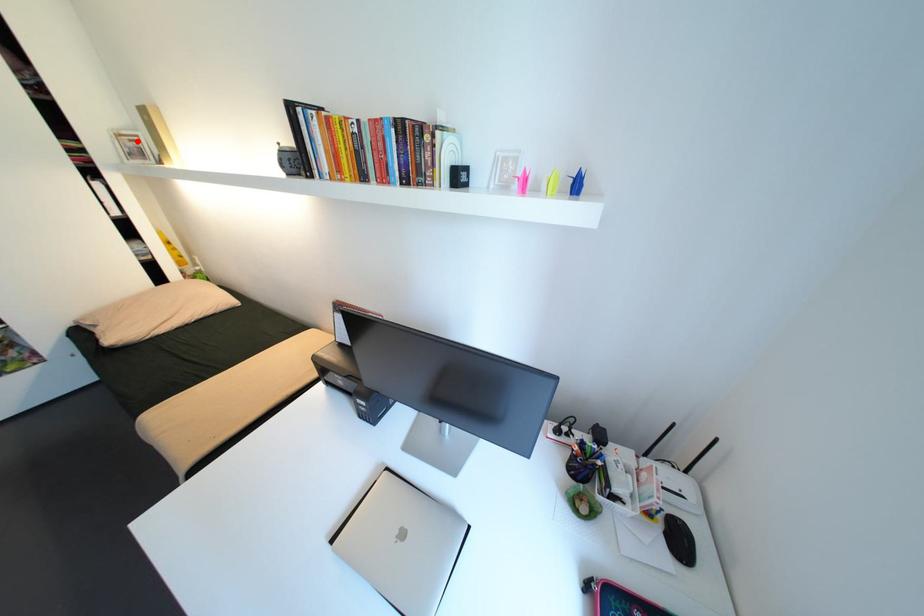
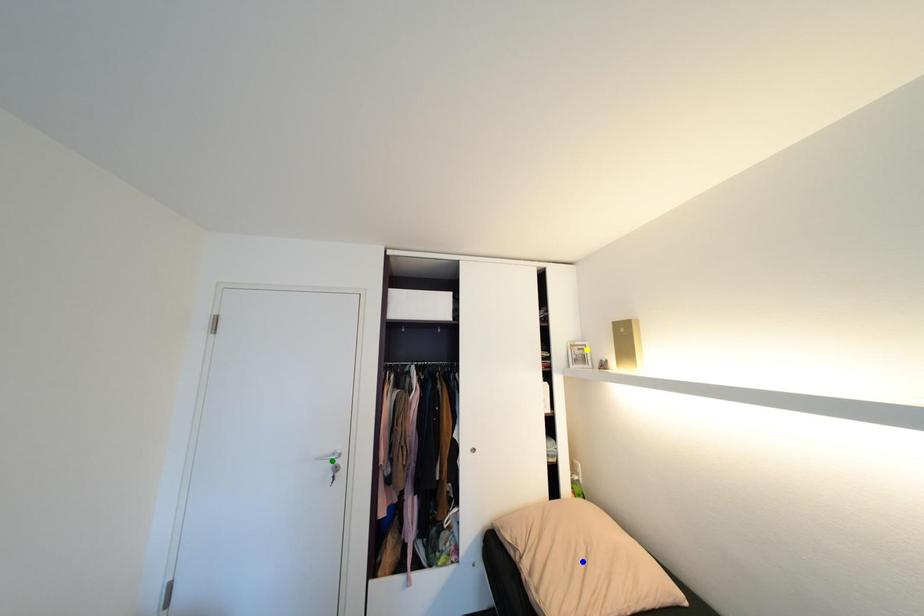
Question: I am providing you with two images of the same scene from different viewpoints. A red point is marked on the first image. You are given multiple points on the second image. Which spot in image 2 lines up with the point in image 1?

Choices:
 (A) green point
 (B) blue point
 (C) yellow point

Answer: (C)